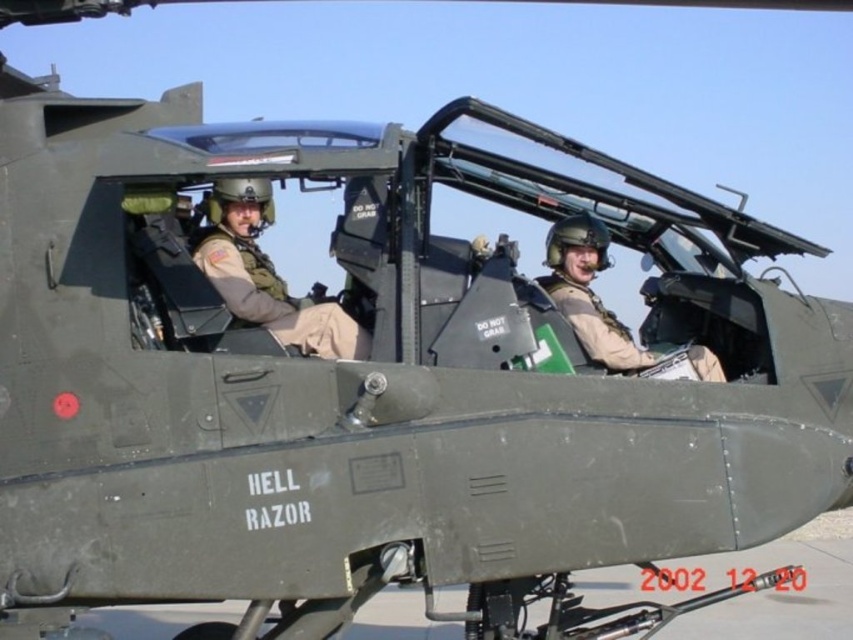
Question: Which of the following is the closest to the observer?

Choices:
 (A) (705, 360)
 (B) (218, 253)

Answer: (B)

Question: Which point is closer to the camera taking this photo?

Choices:
 (A) (328, 356)
 (B) (631, 342)

Answer: (A)

Question: Is matte khaki uniform at center positioned behind matte green helmet at center?

Choices:
 (A) no
 (B) yes

Answer: (A)

Question: Does matte khaki uniform at center appear on the right side of matte green helmet at center?

Choices:
 (A) no
 (B) yes

Answer: (A)

Question: Which point appears farthest from the camera in this image?

Choices:
 (A) (314, 323)
 (B) (596, 328)

Answer: (B)

Question: Is matte khaki uniform at center to the right of matte green helmet at center from the viewer's perspective?

Choices:
 (A) yes
 (B) no

Answer: (B)